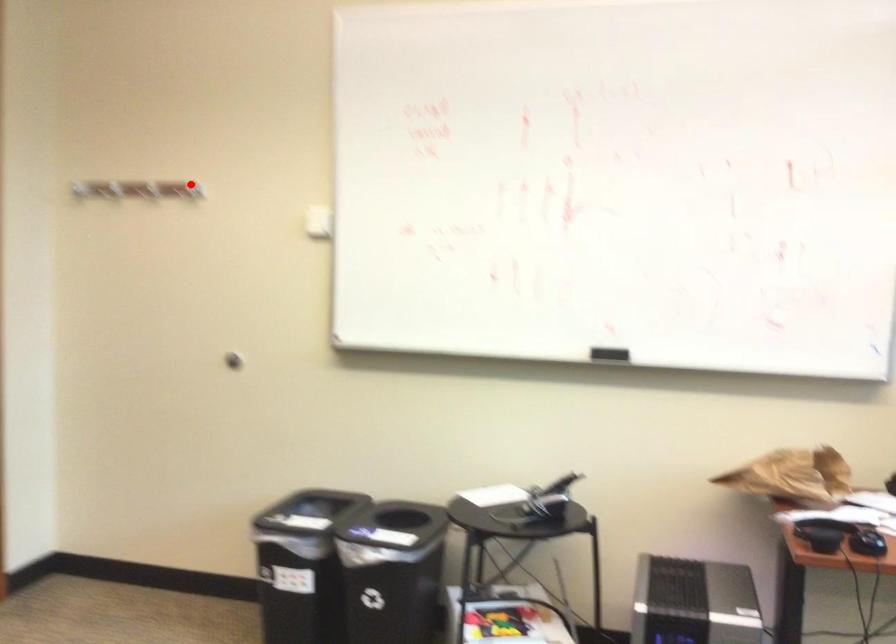
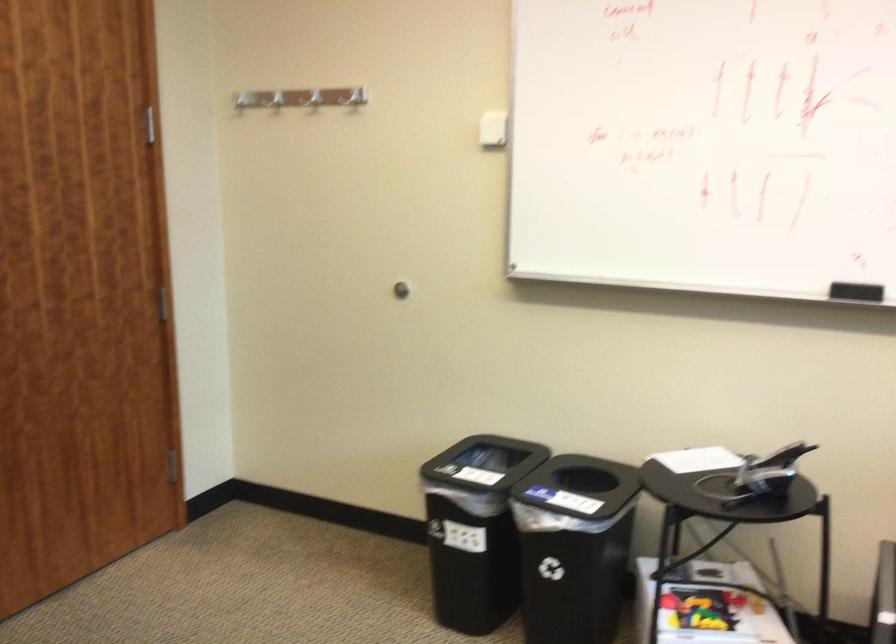
The point at the highlighted location is marked in the first image. Where is the corresponding point in the second image?

(352, 97)